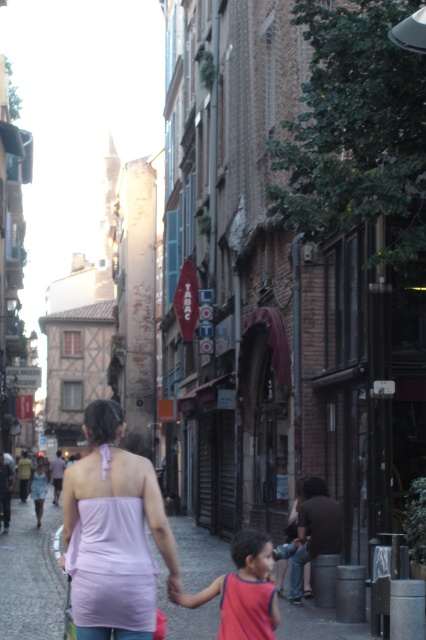
Question: Is lavender satin halter top at center bigger than red sleeveless shirt at lower center?

Choices:
 (A) no
 (B) yes

Answer: (B)

Question: Which of the following is the farthest from the observer?

Choices:
 (A) (126, 458)
 (B) (267, 564)

Answer: (B)

Question: Which object is closer to the camera taking this photo?

Choices:
 (A) lavender satin halter top at center
 (B) red sleeveless shirt at lower center

Answer: (A)

Question: In this image, where is lavender satin halter top at center located relative to red sleeveless shirt at lower center?

Choices:
 (A) left
 (B) right

Answer: (A)

Question: Is lavender satin halter top at center positioned in front of red sleeveless shirt at lower center?

Choices:
 (A) no
 (B) yes

Answer: (B)